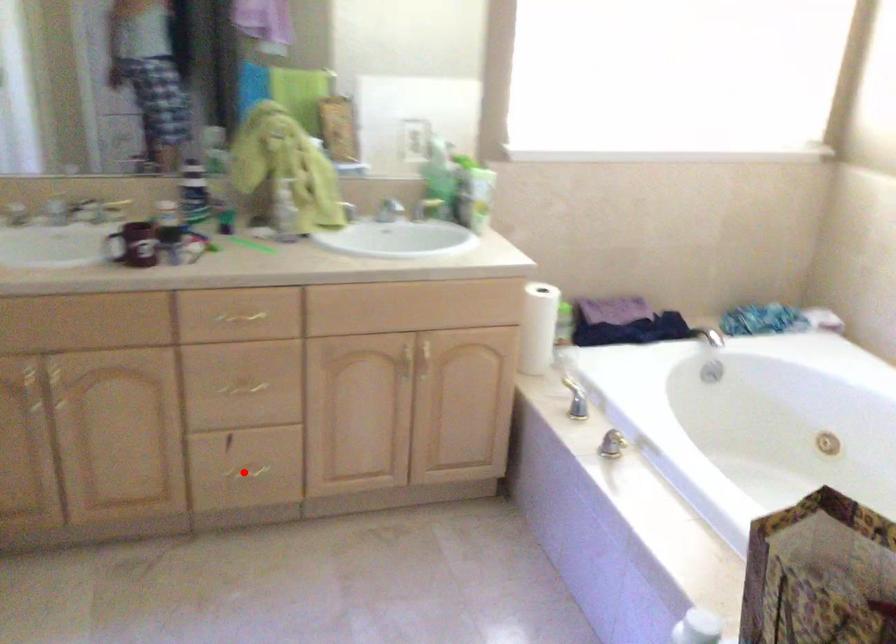
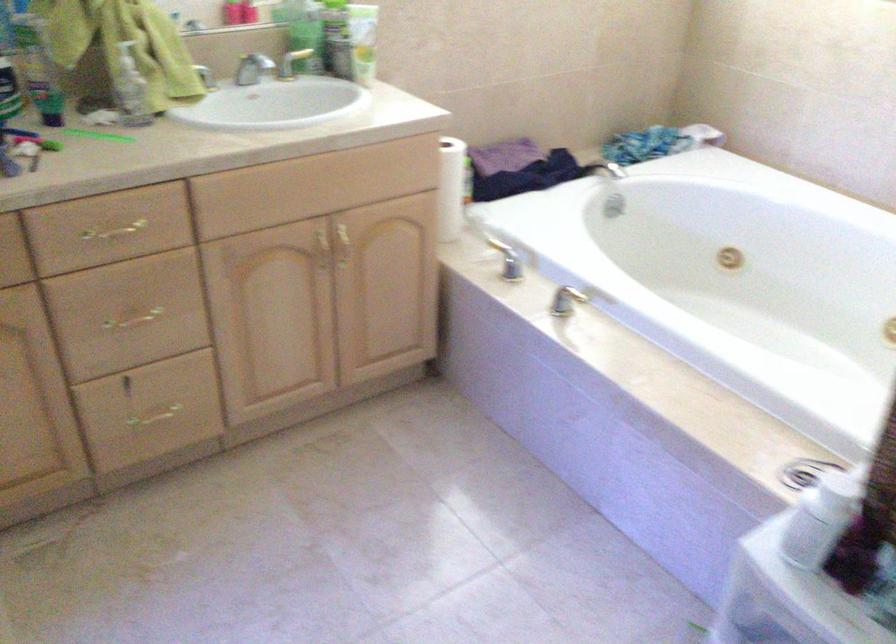
Find the pixel in the second image that matches the highlighted location in the first image.

(154, 415)